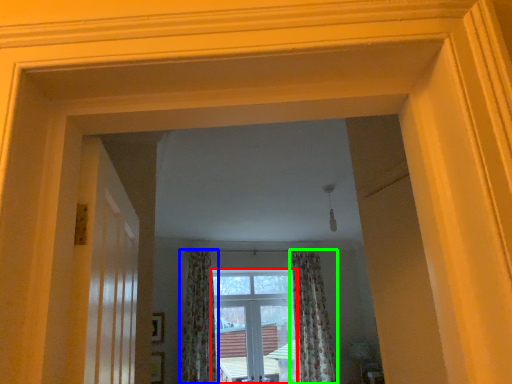
Question: Based on their relative distances, which object is nearer to window (highlighted by a red box)? Choose from curtain (highlighted by a blue box) and curtain (highlighted by a green box).

Choices:
 (A) curtain
 (B) curtain

Answer: (B)